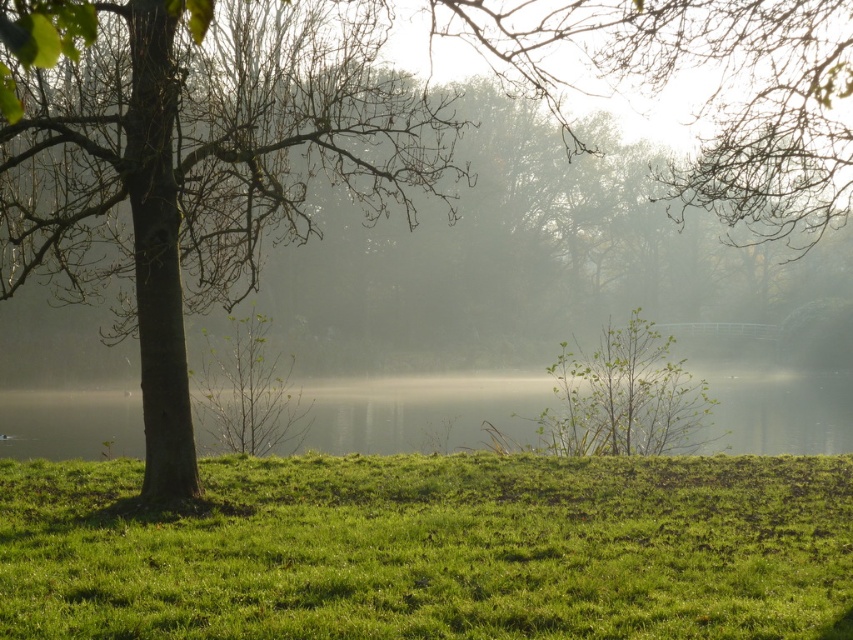
Looking at this image, between green grassy at lower left and green water at center, which one appears on the right side from the viewer's perspective?

green water at center is more to the right.

Can you confirm if green grassy at lower left is positioned to the right of green water at center?

In fact, green grassy at lower left is to the left of green water at center.

Who is more forward, [537,540] or [767,445]?

Point [537,540]

Where is `green grassy at lower left`? Image resolution: width=853 pixels, height=640 pixels. green grassy at lower left is located at coordinates (433, 548).